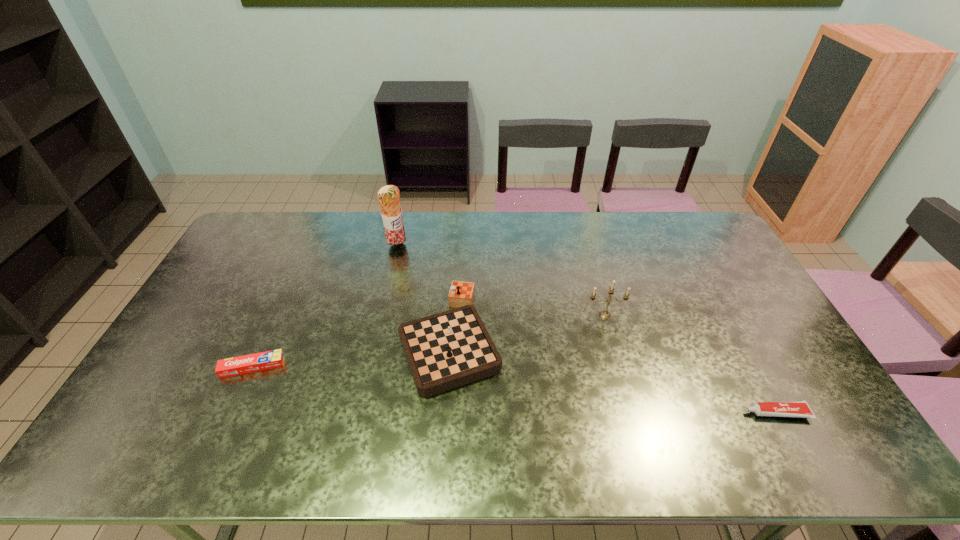
The width and height of the screenshot is (960, 540). I want to click on vacant space at the left edge of the desktop, so click(224, 318).

Image resolution: width=960 pixels, height=540 pixels. What are the coordinates of `vacant space at the right edge of the desktop` in the screenshot? It's located at (726, 298).

This screenshot has height=540, width=960. What are the coordinates of `vacant region at the far left corner of the desktop` in the screenshot? It's located at (237, 244).

In order to click on vacant point located between the right toothpaste and the leftmost object in this screenshot , I will do `click(515, 390)`.

Where is `free space between the burrito and the third shortest object`? free space between the burrito and the third shortest object is located at coordinates (423, 293).

Find the location of a particular element. The width and height of the screenshot is (960, 540). vacant space that's between the left toothpaste and the second object from left to right is located at coordinates (324, 307).

The width and height of the screenshot is (960, 540). I want to click on free space between the nearer toothpaste and the left toothpaste, so click(x=515, y=390).

Identify the location of empty space between the third object from left to right and the farther toothpaste. (351, 353).

In order to click on vacant area that lies between the candle and the chessboard in this screenshot , I will do `click(527, 327)`.

At what (x,y) coordinates should I click in order to perform the action: click on free space between the nearest object and the third tallest object. Please return your answer as a coordinate pair (x, y). Image resolution: width=960 pixels, height=540 pixels. Looking at the image, I should click on (613, 376).